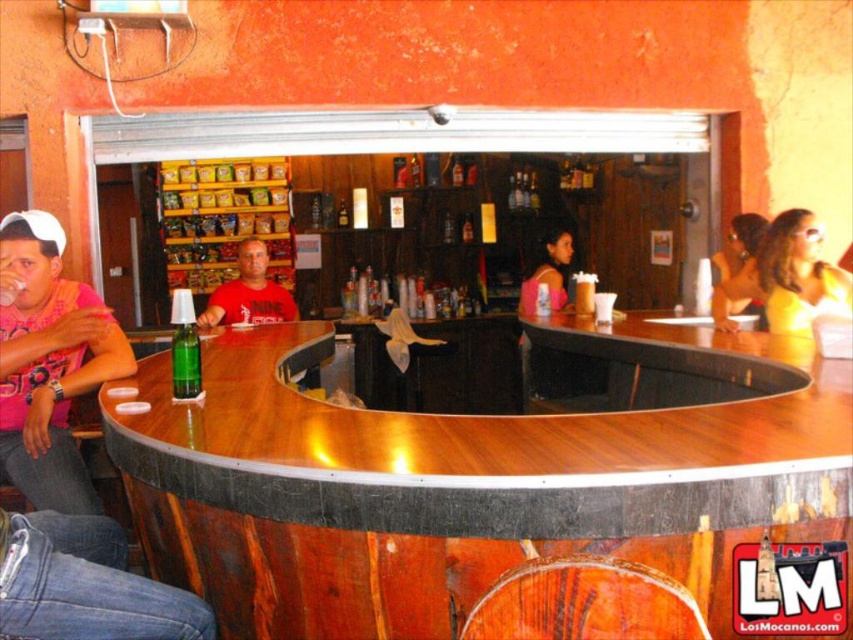
Question: Is green glass bottle at center to the right of pink fabric top at center from the viewer's perspective?

Choices:
 (A) no
 (B) yes

Answer: (A)

Question: Which object is positioned farthest from the pink fabric top at center?

Choices:
 (A) green glass bottle at center
 (B) yellow fabric dress at center

Answer: (A)

Question: Which of the following is the closest to the observer?

Choices:
 (A) yellow fabric dress at center
 (B) pink matte shirt at left
 (C) green glass bottle at center

Answer: (C)

Question: Which point is farther from the camera taking this photo?

Choices:
 (A) (247, 284)
 (B) (775, 296)

Answer: (A)

Question: Is pink matte shirt at left in front of yellow matte shirt at right?

Choices:
 (A) yes
 (B) no

Answer: (A)

Question: Where is yellow matte shirt at right located in relation to green glass bottle at center in the image?

Choices:
 (A) left
 (B) right

Answer: (B)